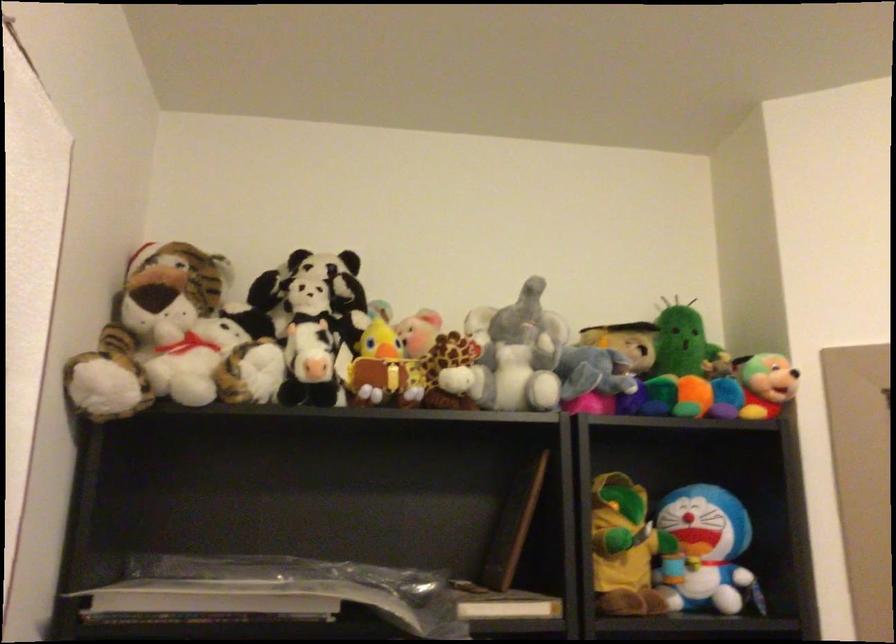
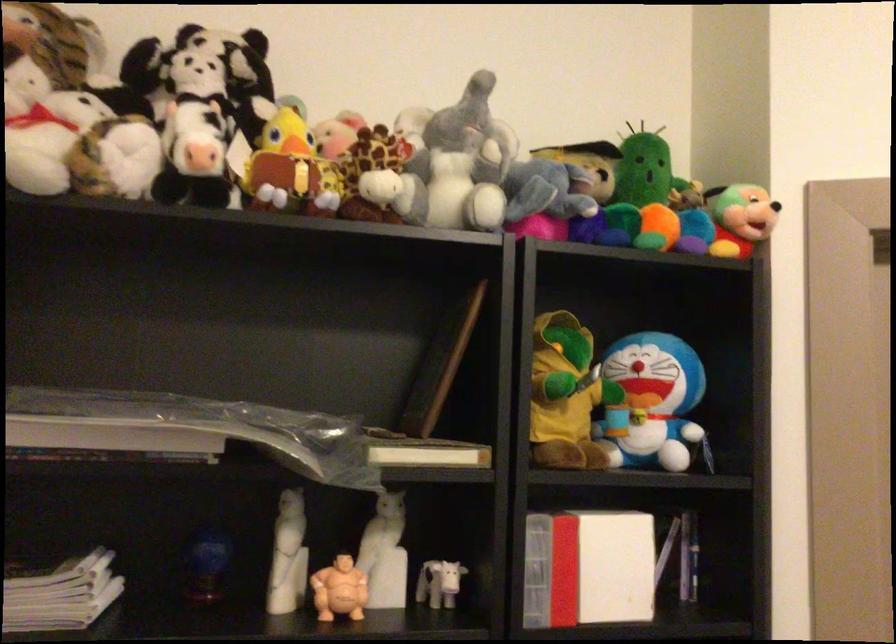
Where in the second image is the point corresponding to (707,552) from the first image?

(651, 402)